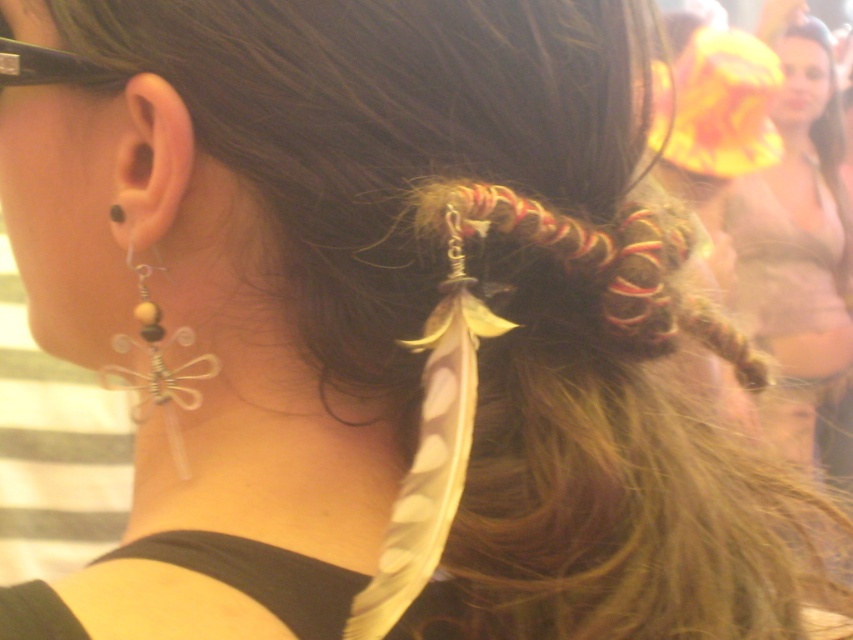
You are a hairstylist trying to place a new accessory on the clear plastic dragonfly at ear. Which direction should you move it to avoid overlapping with the matte gold hair at upper right?

The matte gold hair at upper right is positioned on the right side of clear plastic dragonfly at ear, so moving it to the left would avoid overlapping.

You are a hairstylist trying to adjust the placement of the matte gold hair at upper right and the clear plastic dragonfly at ear. Given that the distance between them is 2.50 meters, can you move the dragonfly closer to the hair without exceeding a 1.50 meter separation?

The current distance between the matte gold hair at upper right and the clear plastic dragonfly at ear is 2.50 meters. To reduce it to 1.50 meters, you would need to move the dragonfly 1.00 meters closer to the matte gold hair at upper right.

You are a hairstylist looking at the image. You need to place a new accessory between the matte gold hair at upper right and the clear plastic dragonfly at ear. Which object should the accessory be placed closer to?

The accessory should be placed closer to the clear plastic dragonfly at ear because the matte gold hair at upper right is located above it, so the dragonfly is lower and the space between them allows placement near the lower object.